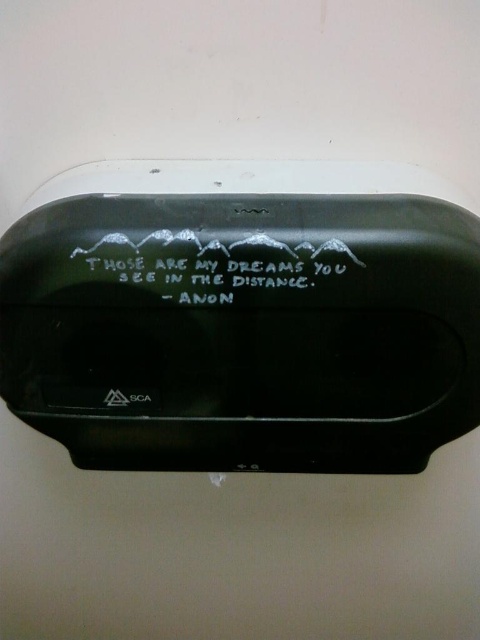
Who is shorter, matte black mirror at center or white matte text at center?

With less height is white matte text at center.

The image size is (480, 640). In order to click on matte black mirror at center in this screenshot , I will do `click(242, 330)`.

What do you see at coordinates (242, 330) in the screenshot? I see `matte black mirror at center` at bounding box center [242, 330].

At what (x,y) coordinates should I click in order to perform the action: click on matte black mirror at center. Please return your answer as a coordinate pair (x, y). Looking at the image, I should click on (242, 330).